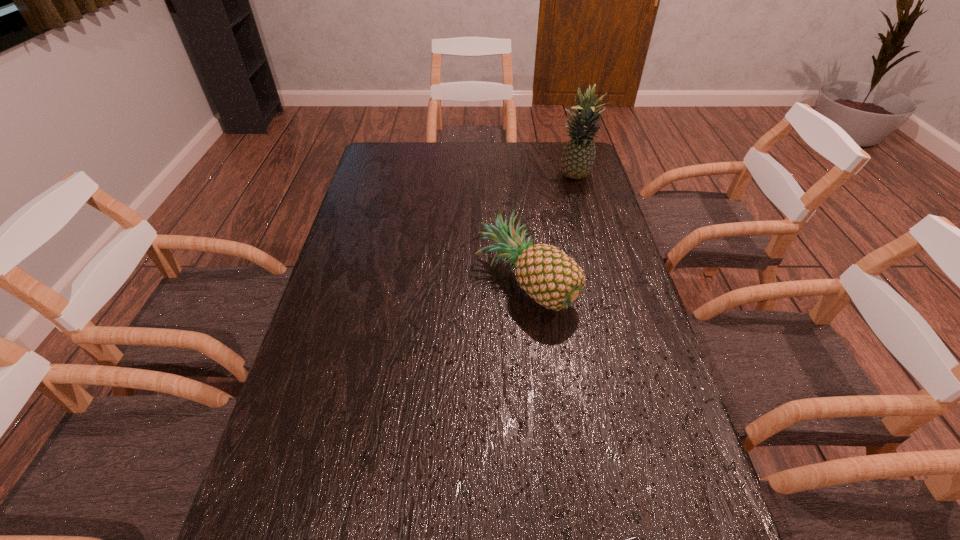
Identify the location of the rightmost object. (578, 158).

At what (x,y) coordinates should I click in order to perform the action: click on the right pineapple. Please return your answer as a coordinate pair (x, y). Looking at the image, I should click on (578, 158).

Image resolution: width=960 pixels, height=540 pixels. Identify the location of the nearer pineapple. (548, 275).

Where is `the left pineapple`? The image size is (960, 540). the left pineapple is located at coordinates (548, 275).

Locate an element on the screen. The image size is (960, 540). vacant space situated 0.390m on the front of the farthest object is located at coordinates (598, 261).

The image size is (960, 540). I want to click on vacant area situated on the left of the second nearest object, so click(444, 282).

I want to click on object present at the far edge, so click(x=578, y=158).

Locate an element on the screen. object at the right edge is located at coordinates (578, 158).

Image resolution: width=960 pixels, height=540 pixels. I want to click on object at the far right corner, so click(578, 158).

The height and width of the screenshot is (540, 960). In the image, there is a desktop. Find the location of `free space at the far edge`. free space at the far edge is located at coordinates (410, 167).